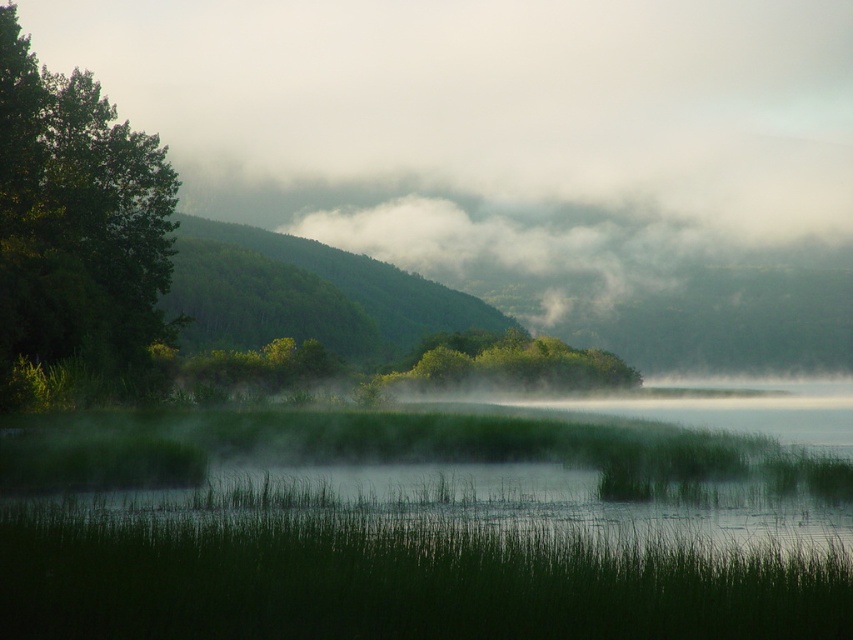
Based on the photo, is the position of green grassy water at center more distant than that of green leafy tree at left?

No, it is not.

Is green grassy water at center to the right of green leafy tree at left from the viewer's perspective?

Indeed, green grassy water at center is positioned on the right side of green leafy tree at left.

Describe the element at coordinates (456, 470) in the screenshot. I see `green grassy water at center` at that location.

Identify the location of green grassy water at center. Image resolution: width=853 pixels, height=640 pixels. (456, 470).

Between point (79, 141) and point (601, 365), which one is positioned behind?

The point (601, 365) is behind.

Does green leafy tree at left have a smaller size compared to green leafy bush at center?

Yes.

What do you see at coordinates (74, 224) in the screenshot?
I see `green leafy tree at left` at bounding box center [74, 224].

Identify the location of green leafy tree at left. (74, 224).

Between green leafy tree at left and green forested hill at center, which one is positioned lower?

Positioned lower is green forested hill at center.

Who is shorter, green leafy tree at left or green forested hill at center?

Standing shorter between the two is green forested hill at center.

Find the location of a particular element. The image size is (853, 640). green leafy tree at left is located at coordinates (74, 224).

At what (x,y) coordinates should I click in order to perform the action: click on green leafy tree at left. Please return your answer as a coordinate pair (x, y). The width and height of the screenshot is (853, 640). Looking at the image, I should click on click(74, 224).